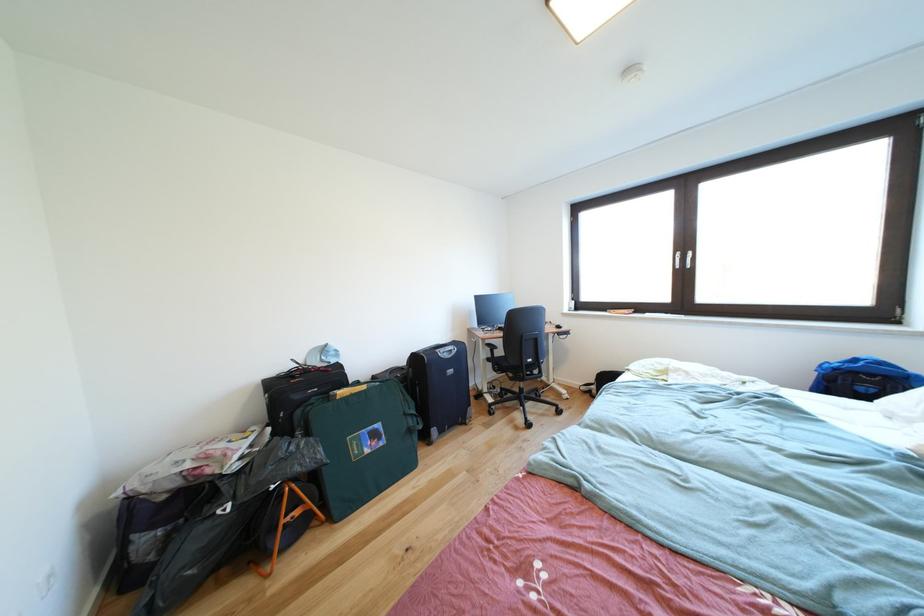
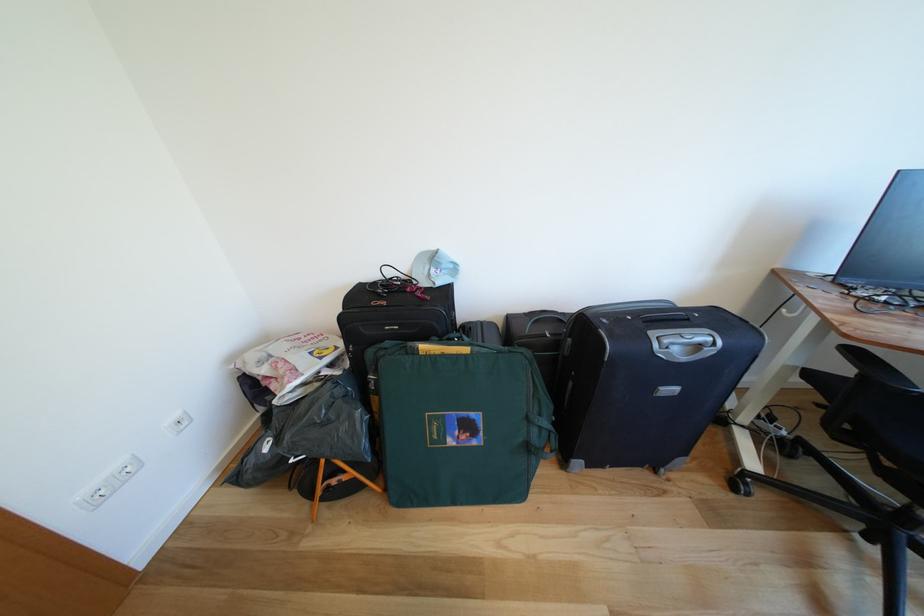
The point at (458, 355) is marked in the first image. Where is the corresponding point in the second image?

(707, 351)